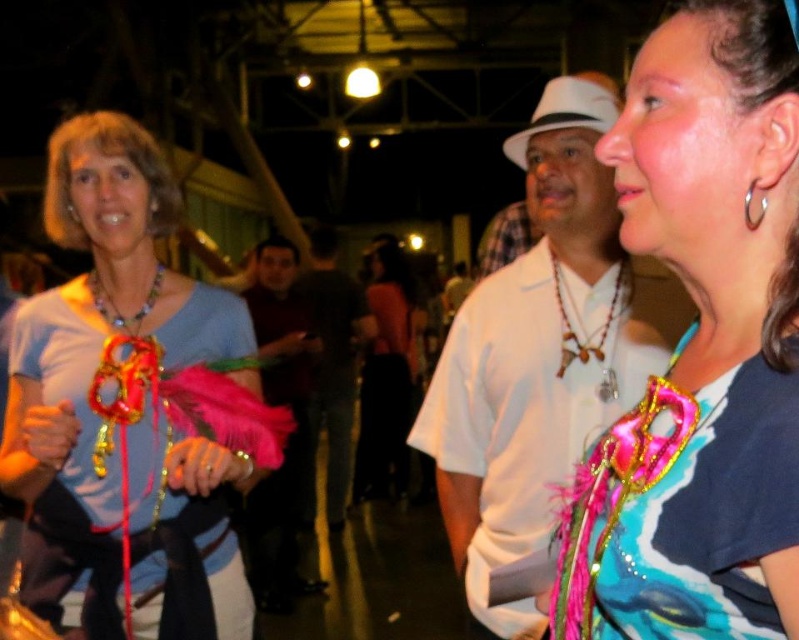
You are a photographer at the event and need to capture both the shiny pink feather boa at center and the dark brown leather jacket at center in a single frame. Based on their positions, which one should you focus on first to ensure both are in the frame?

The shiny pink feather boa at center is positioned on the right side of dark brown leather jacket at center. To capture both in a single frame, focus on the dark brown leather jacket at center first as it is on the left, allowing the photographer to adjust the frame to include the rightward positioned shiny pink feather boa at center.

In the scene shown: You are standing in the middle of the room and want to greet both the white matte shirt at center and the black satin dress at center. Which one should you approach first to reach the closer one?

You should approach the white matte shirt at center first because it is closer to you than the black satin dress at center.

From the picture: Based on the scene description, can you identify the object located at the coordinates point (124, 467)?

The object at point (124, 467) is the matte blue shirt at left.